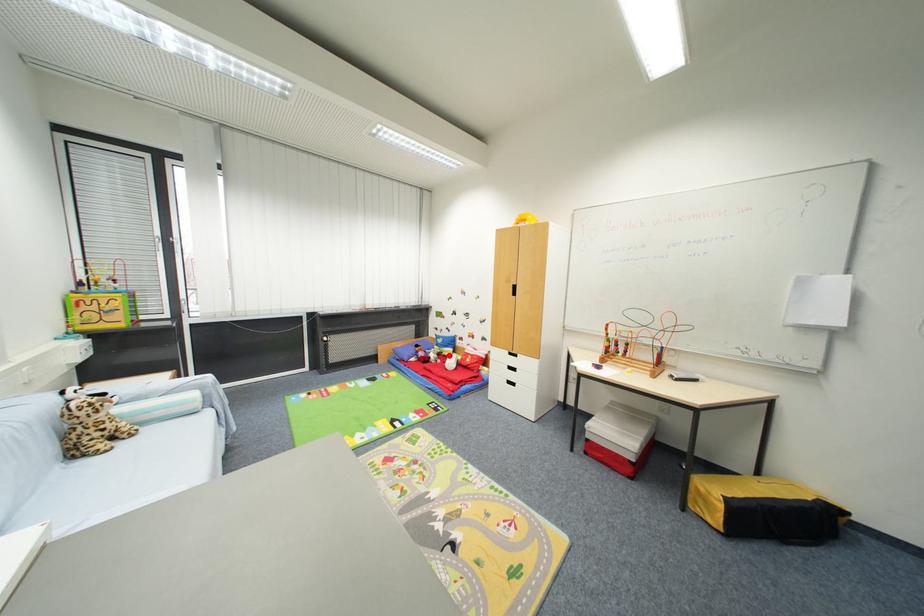
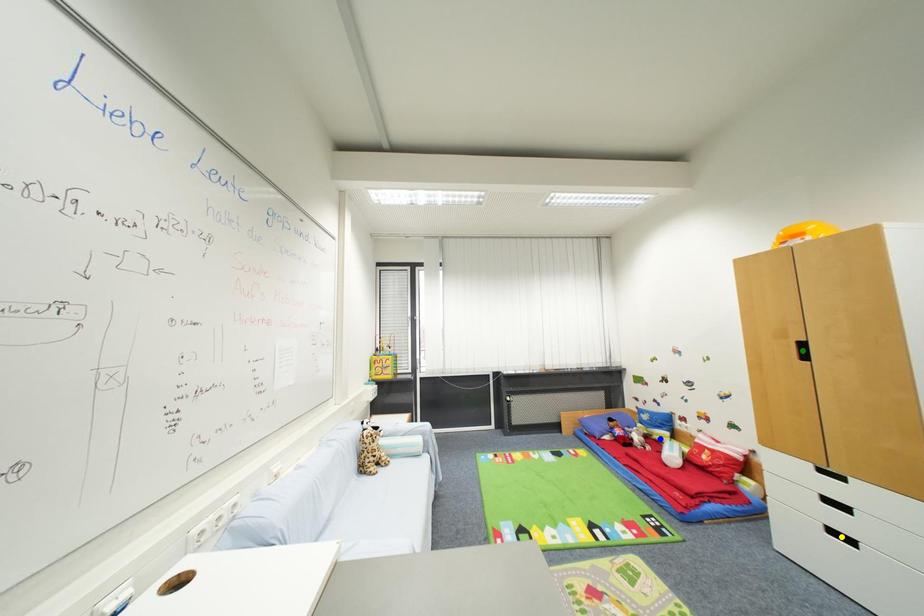
Question: I am providing you with two images of the same scene from different viewpoints. A red point is marked on the first image. You are given multiple points on the second image. Which point in image 2 represents the same 3d spot as the red point in image 1?

Choices:
 (A) blue point
 (B) yellow point
 (C) green point

Answer: (A)